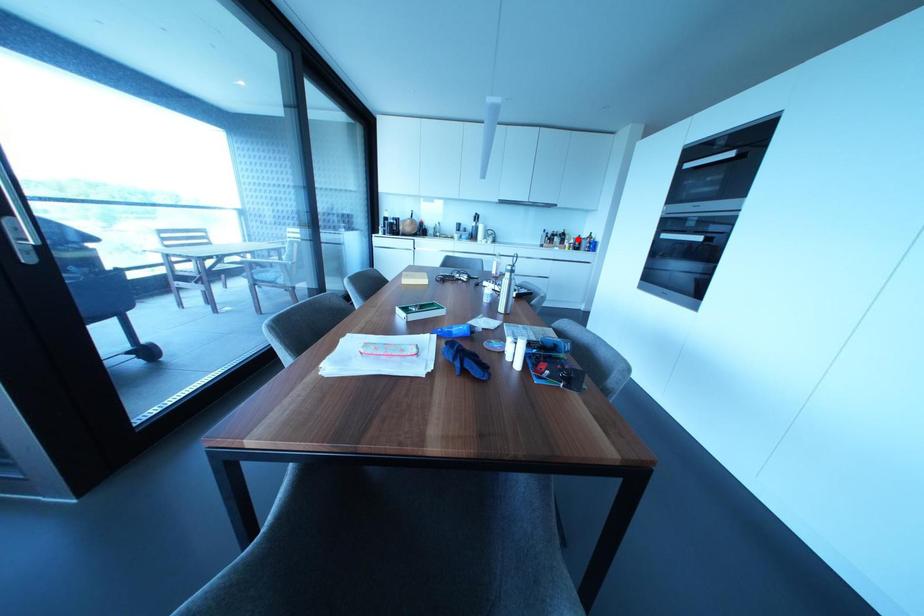
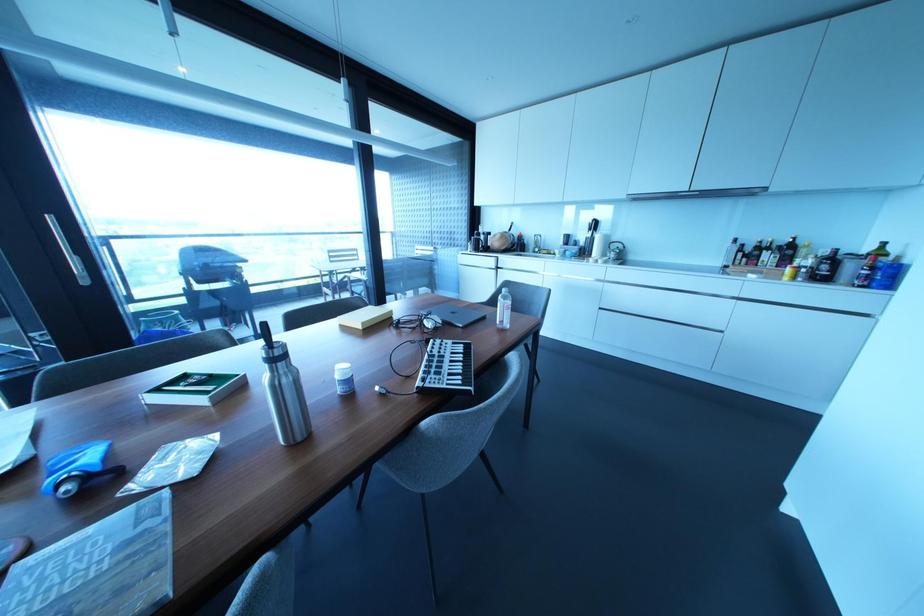
Question: A red point is marked in image1. In image2, is the corresponding 3D point closer to the camera or farther? Reply with the corresponding letter.

Choices:
 (A) The corresponding 3D point is closer.
 (B) The corresponding 3D point is farther.

Answer: (B)